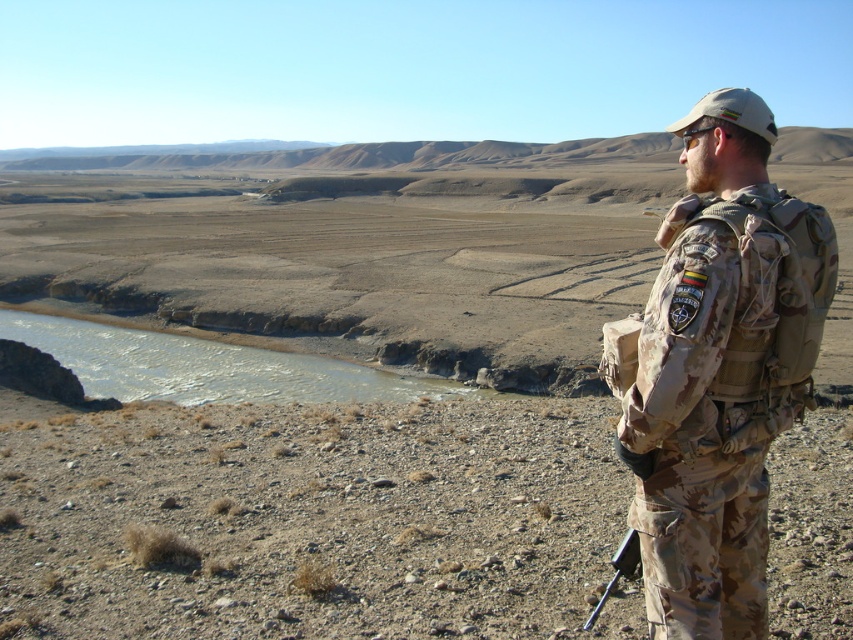
You are a hiker in the desert and you see a camouflage uniform at right and a black plastic rifle at lower right. Which object is taller?

The camouflage uniform at right is taller than the black plastic rifle at lower right.

You are an explorer in the desert and see a camouflage uniform at right and a black plastic rifle at lower right. Which item is located more to the right?

The camouflage uniform at right is positioned on the right side of the black plastic rifle at lower right, so it is more to the right.

You are a soldier carrying a black plastic rifle at lower right. You need to hand it to your comrade wearing a camouflage uniform at right. Can you reach them without moving your feet?

The distance between the camouflage uniform at right and the black plastic rifle at lower right is 1.32 meters. Since the soldier is holding the black plastic rifle at lower right, they would need to extend their arm approximately 1.32 meters to reach their comrade. Depending on their arm length, it might be possible, but typically an average human arm length is about 0.7 meters, so it may not be reachable without moving.